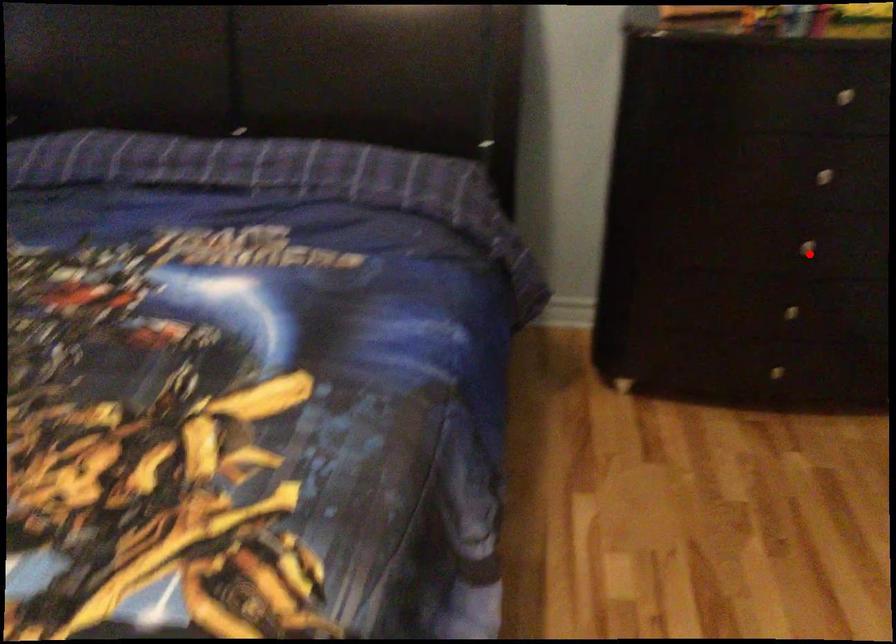
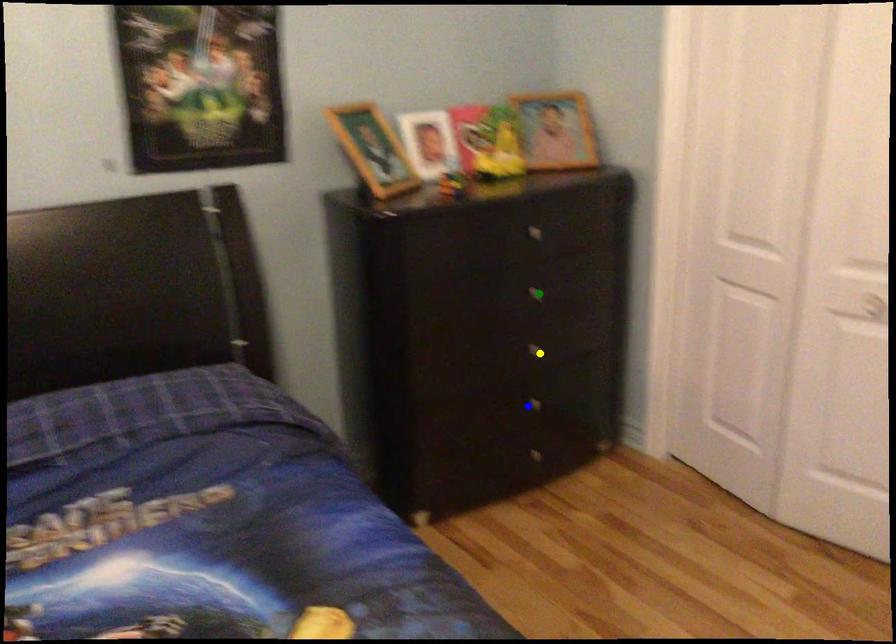
Question: I am providing you with two images of the same scene from different viewpoints. A red point is marked on the first image. You are given multiple points on the second image. Which point in image 2 represents the same 3d spot as the red point in image 1?

Choices:
 (A) green point
 (B) yellow point
 (C) blue point

Answer: (B)